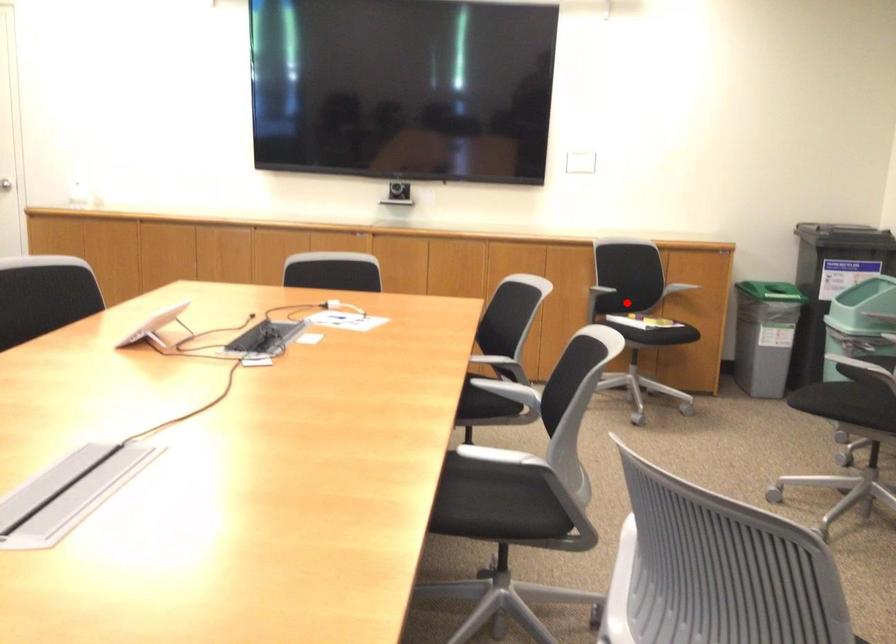
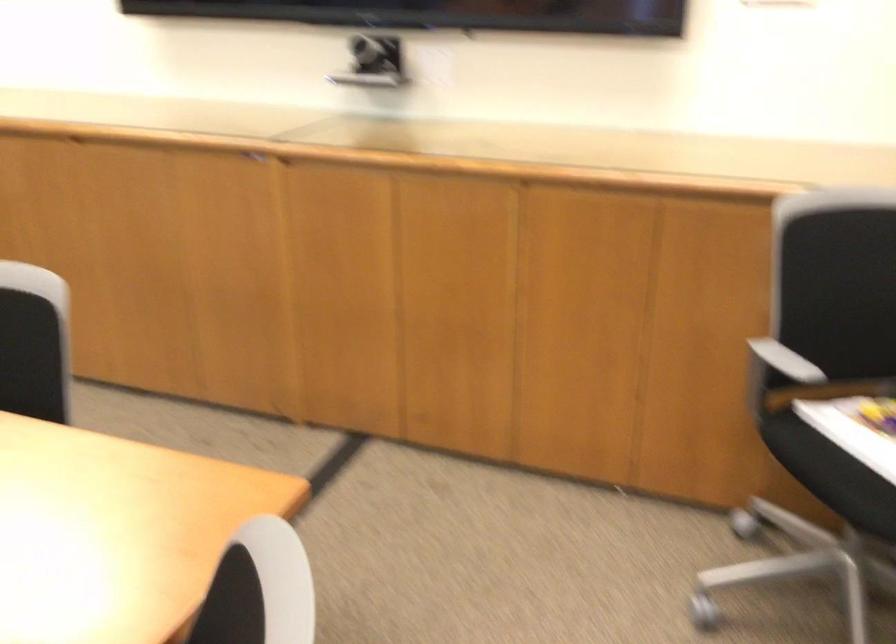
Question: I am providing you with two images of the same scene from different viewpoints. Given a red point in image1, look at the same physical point in image2. Is it:

Choices:
 (A) Closer to the viewpoint
 (B) Farther from the viewpoint

Answer: (A)